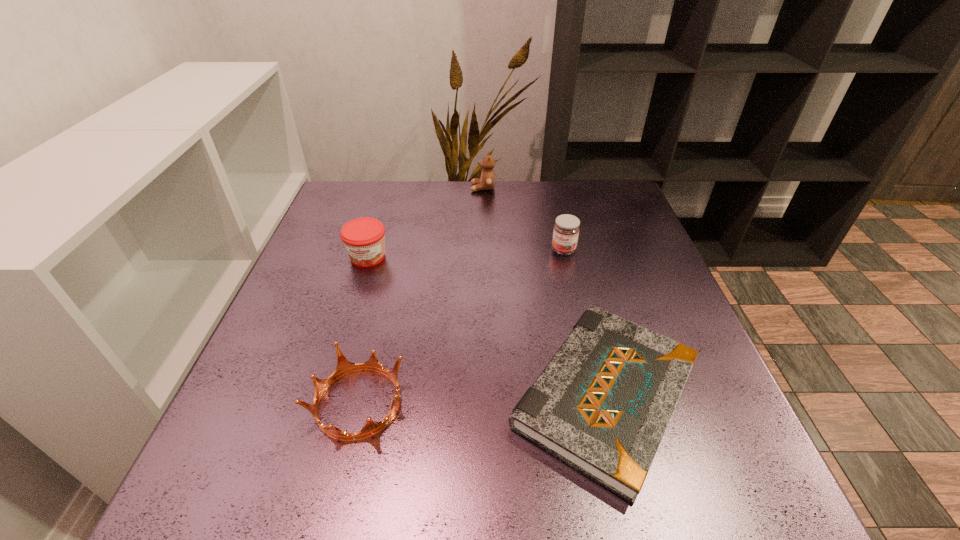
In order to click on vacant space at the near edge of the desktop in this screenshot , I will do 503,465.

Identify the location of vacant region at the left edge of the desktop. (316, 269).

Image resolution: width=960 pixels, height=540 pixels. What are the coordinates of `vacant space at the right edge of the desktop` in the screenshot? It's located at tap(630, 314).

Locate an element on the screen. free spot at the far left corner of the desktop is located at coordinates (355, 217).

At what (x,y) coordinates should I click in order to perform the action: click on vacant space at the near left corner of the desktop. Please return your answer as a coordinate pair (x, y). This screenshot has height=540, width=960. Looking at the image, I should click on (281, 499).

Locate an element on the screen. The image size is (960, 540). vacant region at the far right corner is located at coordinates (602, 200).

You are a GUI agent. You are given a task and a screenshot of the screen. Output one action in this format:
    pyautogui.click(x=<x>, y=<y>)
    Task: Click on the free point between the left jam and the third object from left to right
    This screenshot has width=960, height=540.
    Given the screenshot: What is the action you would take?
    pyautogui.click(x=425, y=222)

Locate an element on the screen. vacant space that's between the tallest object and the right jam is located at coordinates (523, 219).

Identify the location of vacant space in between the fourth tallest object and the notebook. (482, 399).

Identify the location of free point between the right jam and the left jam. The height and width of the screenshot is (540, 960). (466, 254).